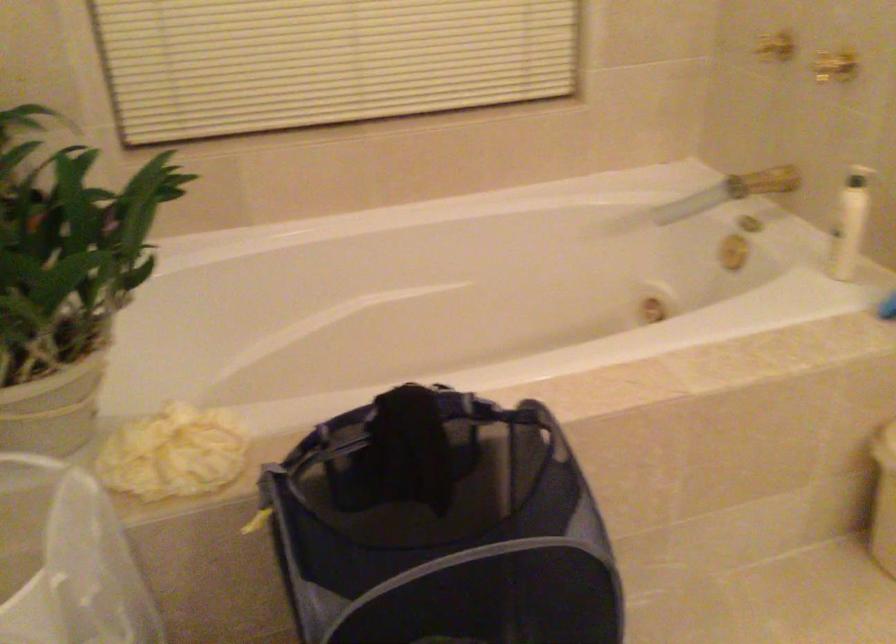
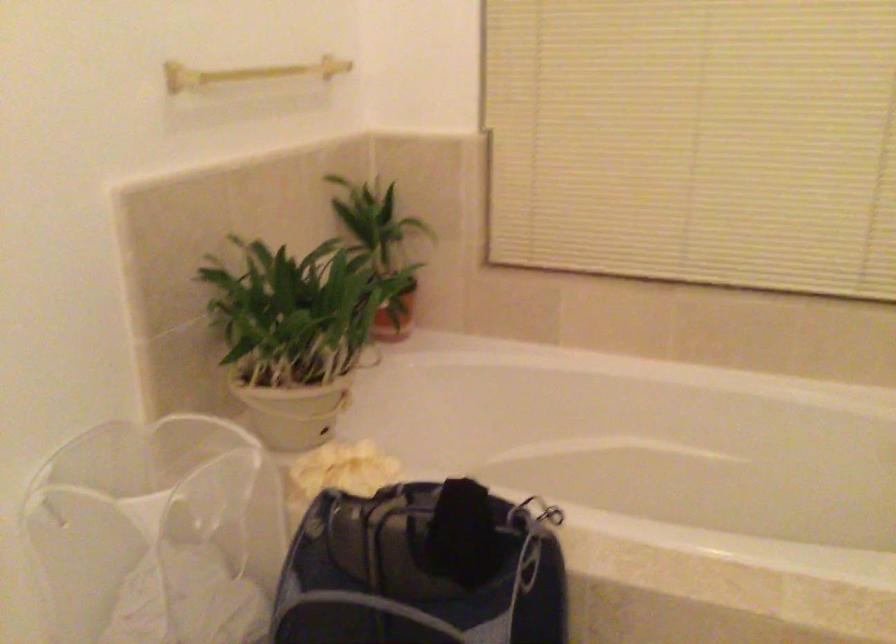
Question: The images are taken continuously from a first-person perspective. In which direction is your viewpoint rotating?

Choices:
 (A) Left
 (B) Right
 (C) Up
 (D) Down

Answer: (A)